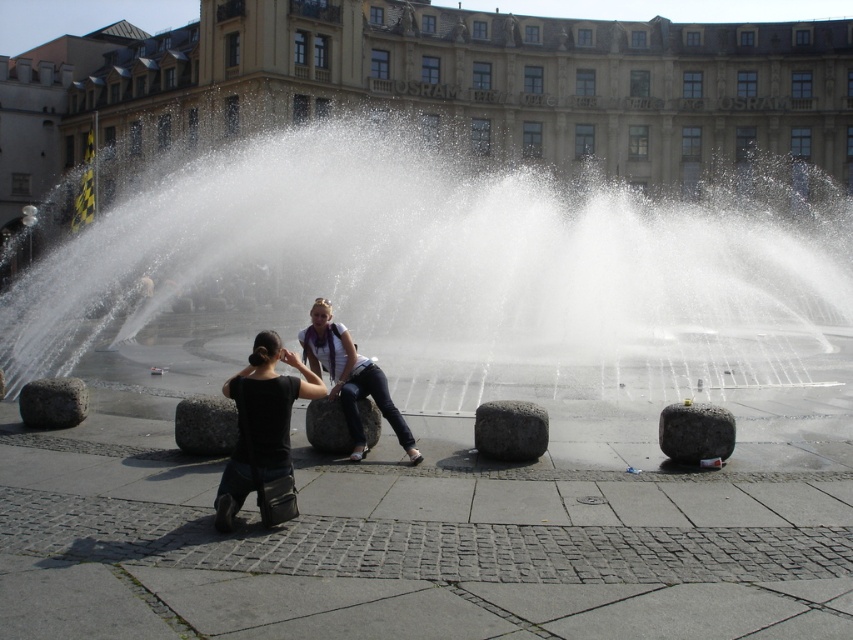
Is black matte shirt at lower left positioned behind gray rough stone at center?

No, black matte shirt at lower left is in front of gray rough stone at center.

Does black matte shirt at lower left have a greater width compared to gray rough stone at center?

No.

This screenshot has height=640, width=853. In order to click on black matte shirt at lower left in this screenshot , I will do `click(263, 433)`.

Find the location of a particular element. The width and height of the screenshot is (853, 640). black matte shirt at lower left is located at coordinates (263, 433).

Does gray rough stone at center appear over granite stone at lower right?

Yes, gray rough stone at center is above granite stone at lower right.

Can you confirm if gray rough stone at center is wider than granite stone at lower right?

Yes, gray rough stone at center is wider than granite stone at lower right.

Between point (509, 432) and point (682, 428), which one is positioned in front?

Positioned in front is point (509, 432).

In order to click on gray rough stone at center in this screenshot , I will do `click(509, 429)`.

Between black matte shirt at lower left and granite stone at lower right, which one appears on the left side from the viewer's perspective?

black matte shirt at lower left is more to the left.

The height and width of the screenshot is (640, 853). What do you see at coordinates (263, 433) in the screenshot? I see `black matte shirt at lower left` at bounding box center [263, 433].

Between point (279, 452) and point (715, 442), which one is positioned in front?

Point (279, 452)

At what (x,y) coordinates should I click in order to perform the action: click on black matte shirt at lower left. Please return your answer as a coordinate pair (x, y). The image size is (853, 640). Looking at the image, I should click on [x=263, y=433].